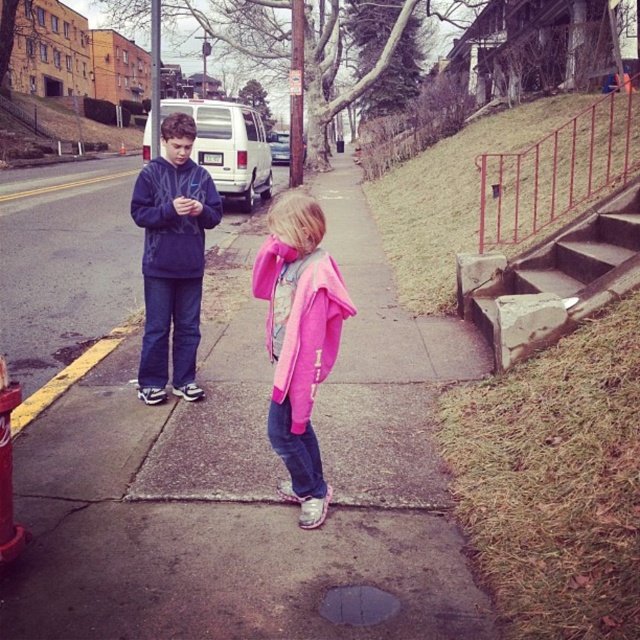
Is concrete stairs at right shorter than brushed metal hydrant at lower left?

No.

Who is more distant from viewer, (x=490, y=307) or (x=3, y=490)?

The point (x=490, y=307) is behind.

What are the coordinates of `concrete stairs at right` in the screenshot? It's located at (554, 278).

Who is lower down, pink fleece jacket at center or concrete stairs at right?

pink fleece jacket at center is lower down.

This screenshot has height=640, width=640. Find the location of `pink fleece jacket at center`. pink fleece jacket at center is located at coordinates (300, 340).

The width and height of the screenshot is (640, 640). Find the location of `pink fleece jacket at center`. pink fleece jacket at center is located at coordinates (300, 340).

Between pink fleece jacket at center and matte blue sweatshirt at center, which one has less height?

With less height is pink fleece jacket at center.

Can you confirm if pink fleece jacket at center is taller than matte blue sweatshirt at center?

In fact, pink fleece jacket at center may be shorter than matte blue sweatshirt at center.

What are the coordinates of `pink fleece jacket at center` in the screenshot? It's located at (300, 340).